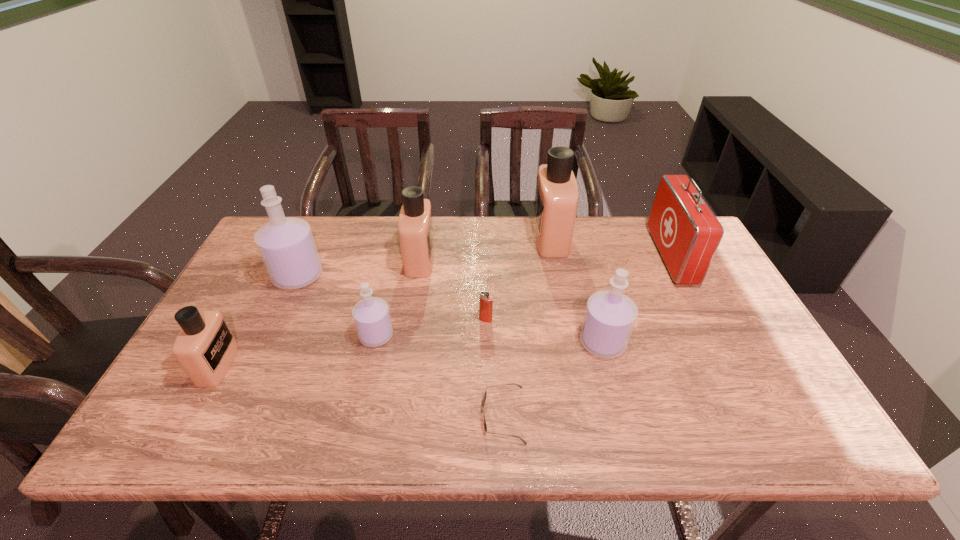
Where is `blank area located on the side of the rightmost object with the first aid cross symbol`? blank area located on the side of the rightmost object with the first aid cross symbol is located at coordinates (630, 256).

Where is `free location located on the front label of the second beige perfume from left to right`? The height and width of the screenshot is (540, 960). free location located on the front label of the second beige perfume from left to right is located at coordinates (532, 259).

Locate an element on the screen. The width and height of the screenshot is (960, 540). vacant space located 0.270m on the left of the rightmost purple perfume is located at coordinates (473, 343).

What are the coordinates of `vacant area situated 0.210m on the back of the second purple perfume from left to right` in the screenshot? It's located at (391, 271).

Where is `free spot located 0.290m on the front label of the nearest beige perfume`? Image resolution: width=960 pixels, height=540 pixels. free spot located 0.290m on the front label of the nearest beige perfume is located at coordinates tap(351, 365).

Where is `vacant area situated 0.290m on the back of the eighth tallest object`? The width and height of the screenshot is (960, 540). vacant area situated 0.290m on the back of the eighth tallest object is located at coordinates (485, 249).

At what (x,y) coordinates should I click in order to perform the action: click on vacant space located 0.220m on the lenses of the shortest object. Please return your answer as a coordinate pair (x, y). This screenshot has width=960, height=540. Looking at the image, I should click on (383, 415).

You are a GUI agent. You are given a task and a screenshot of the screen. Output one action in this format:
    pyautogui.click(x=<x>, y=<y>)
    Task: Click on the free space located 0.280m on the lenses of the shortest object
    The width and height of the screenshot is (960, 540).
    Given the screenshot: What is the action you would take?
    pyautogui.click(x=355, y=415)

Identify the location of free space located on the lenses of the shortest object. (438, 415).

The width and height of the screenshot is (960, 540). What are the coordinates of `the first-aid kit that is at the far edge` in the screenshot? It's located at (686, 232).